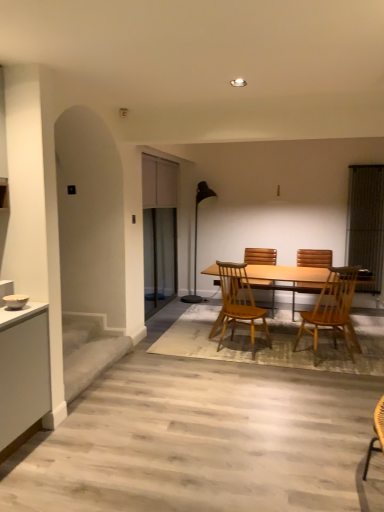
Question: Is black metal floor lamp at center closer to camera compared to clear glass screen door at center?

Choices:
 (A) no
 (B) yes

Answer: (A)

Question: Is black metal floor lamp at center taller than clear glass screen door at center?

Choices:
 (A) yes
 (B) no

Answer: (B)

Question: From a real-world perspective, is black metal floor lamp at center positioned over clear glass screen door at center based on gravity?

Choices:
 (A) yes
 (B) no

Answer: (B)

Question: Can you confirm if black metal floor lamp at center is wider than clear glass screen door at center?

Choices:
 (A) no
 (B) yes

Answer: (B)

Question: Can you confirm if black metal floor lamp at center is thinner than clear glass screen door at center?

Choices:
 (A) no
 (B) yes

Answer: (A)

Question: Would you say clear glass screen door at center is part of black metal floor lamp at center's contents?

Choices:
 (A) no
 (B) yes

Answer: (A)

Question: From the image's perspective, is clear glass screen door at center located beneath matte gray cabinet at upper center?

Choices:
 (A) yes
 (B) no

Answer: (A)

Question: Could you tell me if clear glass screen door at center is turned towards matte gray cabinet at upper center?

Choices:
 (A) no
 (B) yes

Answer: (B)

Question: Is clear glass screen door at center closer to camera compared to matte gray cabinet at upper center?

Choices:
 (A) yes
 (B) no

Answer: (B)

Question: Can you confirm if clear glass screen door at center is bigger than matte gray cabinet at upper center?

Choices:
 (A) yes
 (B) no

Answer: (A)

Question: Is there a large distance between clear glass screen door at center and matte gray cabinet at upper center?

Choices:
 (A) no
 (B) yes

Answer: (A)

Question: Does clear glass screen door at center have a greater width compared to matte gray cabinet at upper center?

Choices:
 (A) yes
 (B) no

Answer: (B)

Question: Can you confirm if wooden chair at center, the 4th chair in the back-to-front sequence, is positioned to the left of black metal floor lamp at center?

Choices:
 (A) yes
 (B) no

Answer: (B)